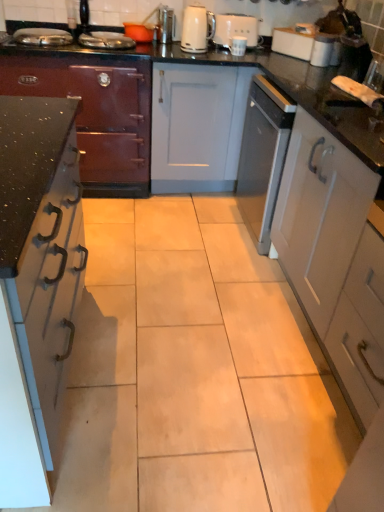
Question: Which direction should I rotate to look at white glossy electric kettle at upper center?

Choices:
 (A) right
 (B) left

Answer: (A)

Question: Can you confirm if white glossy cabinet at right, which is the first cabinetry in right-to-left order, is positioned to the left of black glossy countertop at center?

Choices:
 (A) yes
 (B) no

Answer: (B)

Question: Considering the relative sizes of white glossy cabinet at right, which is the first cabinetry in right-to-left order, and black glossy countertop at center in the image provided, is white glossy cabinet at right, which is the first cabinetry in right-to-left order, taller than black glossy countertop at center?

Choices:
 (A) yes
 (B) no

Answer: (A)

Question: Is white glossy cabinet at right, the third cabinetry from the left, shorter than black glossy countertop at center?

Choices:
 (A) no
 (B) yes

Answer: (A)

Question: Is white glossy cabinet at right, the third cabinetry from the left, located outside black glossy countertop at center?

Choices:
 (A) no
 (B) yes

Answer: (B)

Question: Is white glossy cabinet at right, the third cabinetry from the left, positioned in front of black glossy countertop at center?

Choices:
 (A) no
 (B) yes

Answer: (B)

Question: From a real-world perspective, is white glossy cabinet at right, the third cabinetry from the left, physically above black glossy countertop at center?

Choices:
 (A) no
 (B) yes

Answer: (B)

Question: Is orange matte bowl at upper center, the second appliance when ordered from right to left, shorter than white glossy electric kettle at upper center?

Choices:
 (A) no
 (B) yes

Answer: (B)

Question: From a real-world perspective, is orange matte bowl at upper center, marked as the 1th appliance in a left-to-right arrangement, on white glossy electric kettle at upper center?

Choices:
 (A) yes
 (B) no

Answer: (B)

Question: Is orange matte bowl at upper center, the second appliance when ordered from right to left, outside white glossy electric kettle at upper center?

Choices:
 (A) no
 (B) yes

Answer: (B)

Question: From the image's perspective, is orange matte bowl at upper center, marked as the 1th appliance in a left-to-right arrangement, below white glossy electric kettle at upper center?

Choices:
 (A) no
 (B) yes

Answer: (A)

Question: Can you confirm if orange matte bowl at upper center, the second appliance when ordered from right to left, is taller than white glossy electric kettle at upper center?

Choices:
 (A) no
 (B) yes

Answer: (A)

Question: Is orange matte bowl at upper center, marked as the 1th appliance in a left-to-right arrangement, touching white glossy electric kettle at upper center?

Choices:
 (A) no
 (B) yes

Answer: (A)

Question: From a real-world perspective, is white glossy cabinet at right, which is the first cabinetry in right-to-left order, physically below satin nickel toaster at upper center, marked as the 1th appliance in a right-to-left arrangement?

Choices:
 (A) yes
 (B) no

Answer: (A)